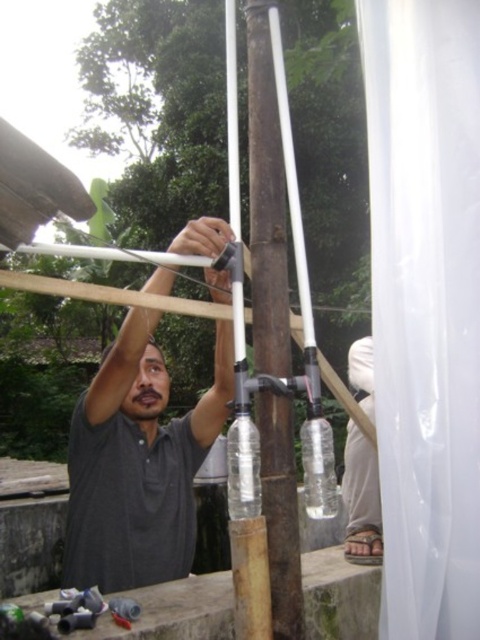
You are a photographer aiming to capture the man operating the filtration system without including the white sheer curtain at right in the frame. Which direction should you position yourself relative to the dark gray skin at upper center to ensure the curtain is out of view?

Position yourself to the left of the dark gray skin at upper center so that the white sheer curtain at right is not in the frame.

You are standing in a room with a window. You see a point marked at coordinate (425, 307). What object is located at that point?

The point at (425, 307) corresponds to the white sheer curtain at right.